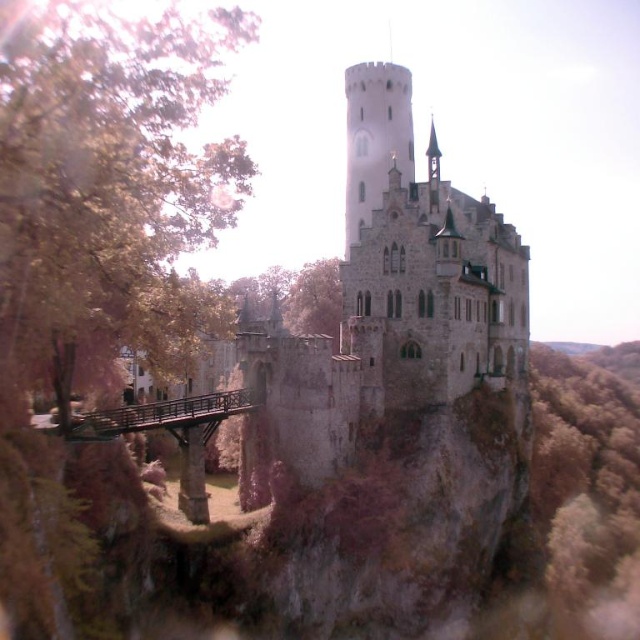
Can you confirm if brown wooden bridge at lower left is smaller than brown wooden bridge at lower center?

Actually, brown wooden bridge at lower left might be larger than brown wooden bridge at lower center.

Can you confirm if brown wooden bridge at lower left is positioned above brown wooden bridge at lower center?

Incorrect, brown wooden bridge at lower left is not positioned above brown wooden bridge at lower center.

Does point (177, 429) come behind point (163, 422)?

Yes, point (177, 429) is behind point (163, 422).

Find the location of a particular element. The width and height of the screenshot is (640, 640). brown wooden bridge at lower left is located at coordinates pyautogui.click(x=172, y=435).

Is brown leafy tree at left below stone medieval castle at center?

No.

Between brown leafy tree at left and stone medieval castle at center, which one has less height?

Standing shorter between the two is brown leafy tree at left.

You are a GUI agent. You are given a task and a screenshot of the screen. Output one action in this format:
    pyautogui.click(x=<x>, y=<y>)
    Task: Click on the brown leafy tree at left
    The height and width of the screenshot is (640, 640).
    Given the screenshot: What is the action you would take?
    pyautogui.click(x=104, y=168)

You are a GUI agent. You are given a task and a screenshot of the screen. Output one action in this format:
    pyautogui.click(x=<x>, y=<y>)
    Task: Click on the brown leafy tree at left
    
    Given the screenshot: What is the action you would take?
    pyautogui.click(x=104, y=168)

Between point (138, 312) and point (176, 422), which one is positioned behind?

Positioned behind is point (176, 422).

Which is in front, point (81, 22) or point (76, 433)?

Point (81, 22) is in front.

Identify the location of brown leafy tree at left. This screenshot has height=640, width=640. (104, 168).